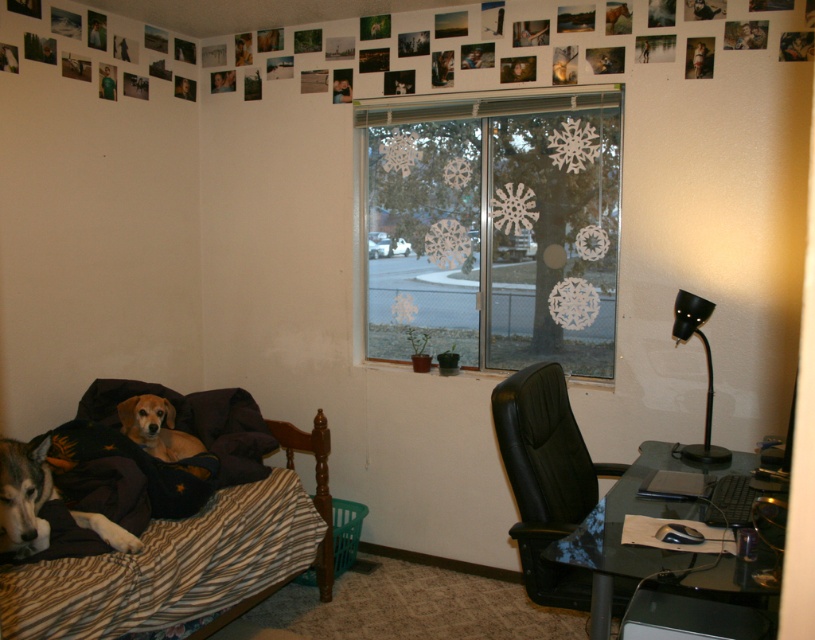
Question: Which object is positioned farthest from the transparent glass computer desk at lower right?

Choices:
 (A) black matte desk lamp at right
 (B) striped fabric bed at lower left

Answer: (B)

Question: In this image, where is white paper snowflakes at center located relative to golden brown fur at left?

Choices:
 (A) above
 (B) below

Answer: (A)

Question: Which object is the closest to the striped fabric bed at lower left?

Choices:
 (A) white fur dog at lower left
 (B) white paper snowflakes at center
 (C) transparent glass computer desk at lower right
 (D) black leather chair at center

Answer: (A)

Question: Is transparent glass computer desk at lower right bigger than white fur dog at lower left?

Choices:
 (A) no
 (B) yes

Answer: (B)

Question: Which point is farther to the camera?

Choices:
 (A) (489, 346)
 (B) (36, 451)

Answer: (A)

Question: Can you confirm if golden brown fur at left is wider than black matte desk lamp at right?

Choices:
 (A) yes
 (B) no

Answer: (A)